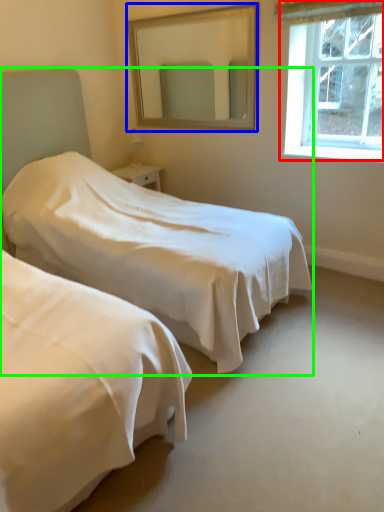
Question: Based on their relative distances, which object is nearer to window (highlighted by a red box)? Choose from mirror (highlighted by a blue box) and bed (highlighted by a green box).

Choices:
 (A) mirror
 (B) bed

Answer: (A)